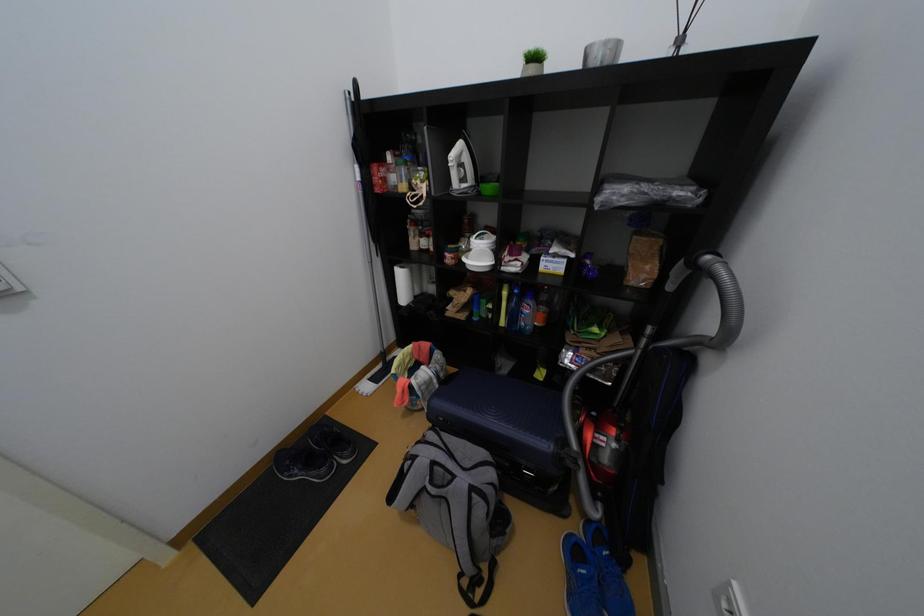
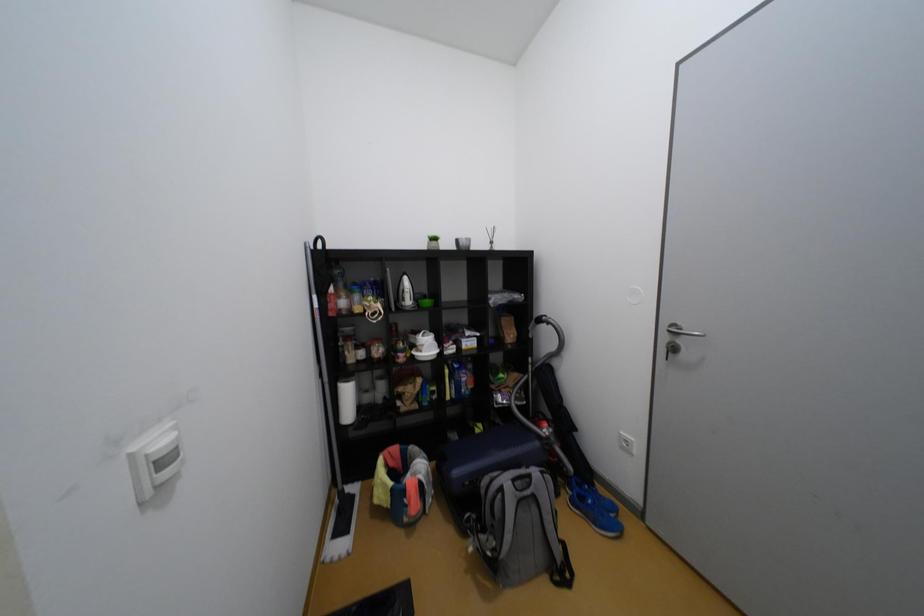
Question: The camera is either moving clockwise (left) or counter-clockwise (right) around the object. The first image is from the beginning of the video and the second image is from the end. Is the camera moving left or right when shooting the video?

Choices:
 (A) Left
 (B) Right

Answer: (A)